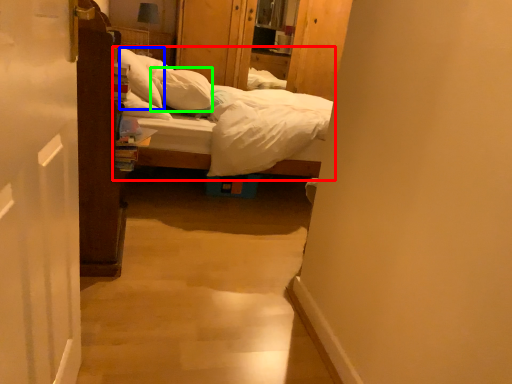
Question: Estimate the real-world distances between objects in this image. Which object is closer to bed (highlighted by a red box), pillow (highlighted by a blue box) or pillow (highlighted by a green box)?

Choices:
 (A) pillow
 (B) pillow

Answer: (A)